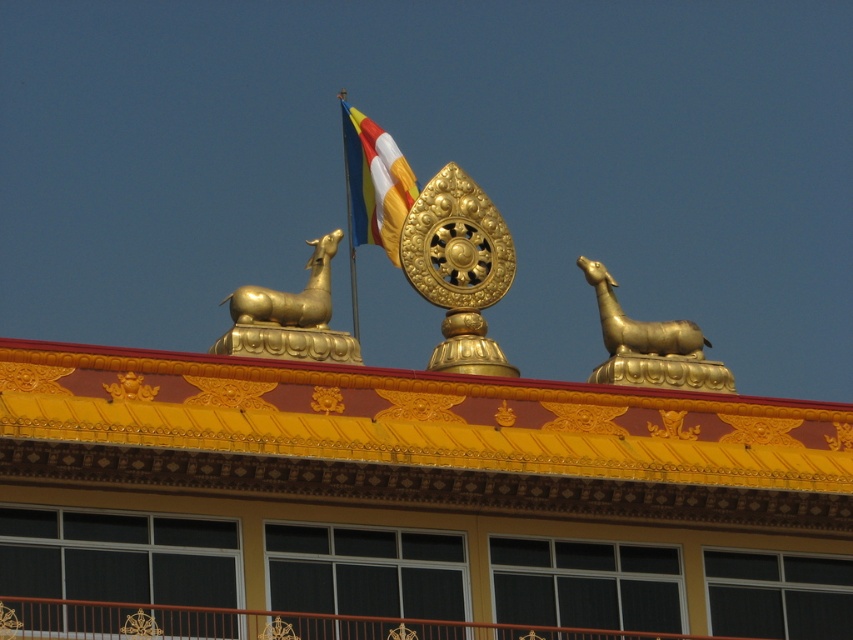
Image resolution: width=853 pixels, height=640 pixels. What do you see at coordinates (289, 317) in the screenshot?
I see `gold polished statue at upper left` at bounding box center [289, 317].

Is gold polished statue at upper left below tri-color fabric flag at upper center?

Indeed, gold polished statue at upper left is positioned under tri-color fabric flag at upper center.

Measure the distance between point (x=299, y=300) and camera.

Point (x=299, y=300) is 66.95 meters from camera.

The image size is (853, 640). I want to click on gold polished statue at upper left, so click(289, 317).

Consider the image. Who is more forward, (611, 339) or (387, 156)?

Point (611, 339) is in front.

Can you confirm if gold polished deer at upper right is positioned below tri-color fabric flag at upper center?

Indeed, gold polished deer at upper right is positioned under tri-color fabric flag at upper center.

Identify the location of gold polished deer at upper right. (650, 346).

The image size is (853, 640). I want to click on gold polished deer at upper right, so click(650, 346).

Consider the image. Can you confirm if gold polished statue at upper left is positioned to the right of gold polished deer at upper right?

Incorrect, gold polished statue at upper left is not on the right side of gold polished deer at upper right.

Is gold polished statue at upper left below gold polished deer at upper right?

No, gold polished statue at upper left is not below gold polished deer at upper right.

From the picture: Measure the distance between point [331,243] and camera.

The distance of point [331,243] from camera is 227.98 feet.

Identify the location of gold polished statue at upper left. (289, 317).